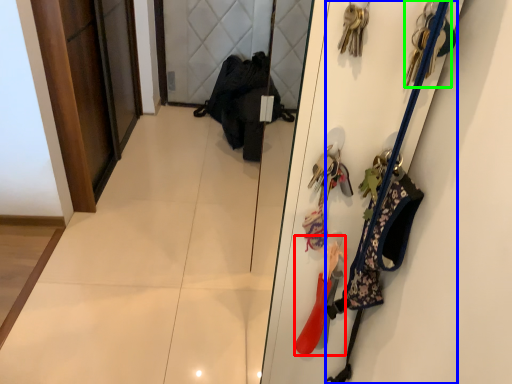
Question: Which object is the closest to the accessory (highlighted by a red box)? Choose among these: accessory (highlighted by a blue box) or accessory (highlighted by a green box).

Choices:
 (A) accessory
 (B) accessory

Answer: (A)